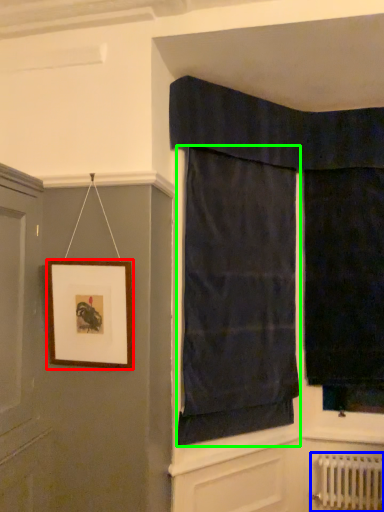
Question: Which is nearer to the picture frame (highlighted by a red box)? radiator (highlighted by a blue box) or curtain (highlighted by a green box).

Choices:
 (A) radiator
 (B) curtain

Answer: (B)